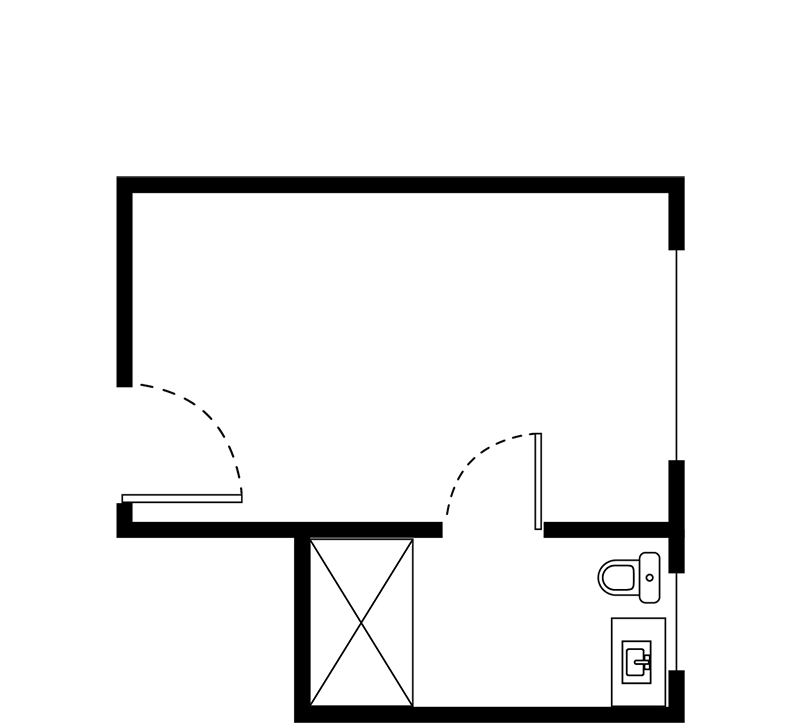
This screenshot has width=800, height=723. I want to click on curved dashed line door swing path, so click(208, 414), click(472, 458).